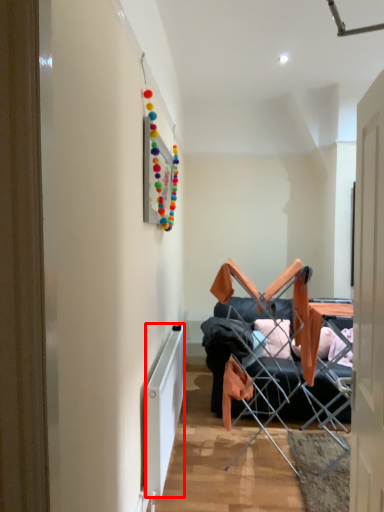
Question: From the image's perspective, where is radiator (annotated by the red box) located relative to chair?

Choices:
 (A) below
 (B) above

Answer: (A)